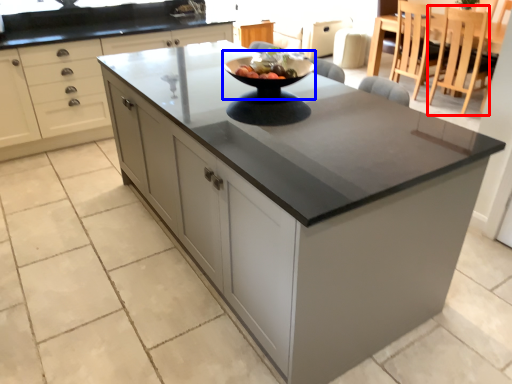
Question: Which object is further to the camera taking this photo, chair (highlighted by a red box) or mixing bowl (highlighted by a blue box)?

Choices:
 (A) chair
 (B) mixing bowl

Answer: (A)